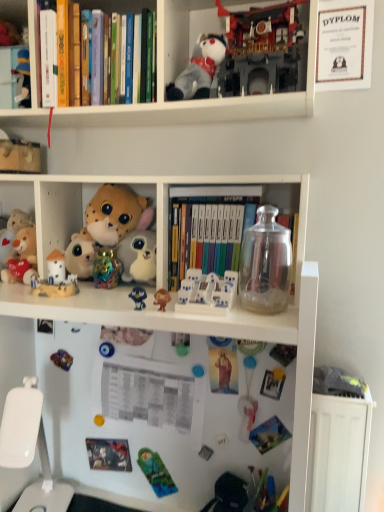
What do you see at coordinates (200, 100) in the screenshot?
I see `white matte bookshelf at upper center` at bounding box center [200, 100].

Looking at this image, what is the approximate width of white plastic toy at left, the 5th toy in the bottom-to-top sequence?

2.44 inches.

The height and width of the screenshot is (512, 384). Find the location of `green plastic toy at lower center, placed as the 1th toy when sorted from bottom to top`. green plastic toy at lower center, placed as the 1th toy when sorted from bottom to top is located at coordinates (156, 473).

In order to click on fluffy white plush at center-left, acting as the sixth toy starting from the bottom in this screenshot , I will do `click(80, 255)`.

At what (x,y) coordinates should I click in order to perform the action: click on transparent glass jar at center, arranged as the second book when viewed from the top. Please return your answer as a coordinate pair (x, y). Looking at the image, I should click on (219, 221).

Describe the element at coordinates (219, 221) in the screenshot. I see `transparent glass jar at center, the 2th book from the left` at that location.

In order to click on white matte bookshelf at upper center in this screenshot , I will do `click(200, 100)`.

Is fluffy white plush at center-left, acting as the sixth toy starting from the bottom, next to hardcover books at upper left, which ranks as the first book in left-to-right order, and touching it?

fluffy white plush at center-left, acting as the sixth toy starting from the bottom, and hardcover books at upper left, which ranks as the first book in left-to-right order, are not in contact.

Which is behind, fluffy white plush at center-left, the 5th toy in the top-to-bottom sequence, or hardcover books at upper left, which ranks as the 2th book in bottom-to-top order?

Positioned behind is fluffy white plush at center-left, the 5th toy in the top-to-bottom sequence.

Could you tell me if fluffy white plush at center-left, the 5th toy in the top-to-bottom sequence, is turned towards hardcover books at upper left, which is the 1th book in top-to-bottom order?

No, fluffy white plush at center-left, the 5th toy in the top-to-bottom sequence, is not turned towards hardcover books at upper left, which is the 1th book in top-to-bottom order.

Between fluffy white plush at center-left, the 5th toy in the top-to-bottom sequence, and hardcover books at upper left, which is the 1th book in top-to-bottom order, which one has larger width?

hardcover books at upper left, which is the 1th book in top-to-bottom order, is wider.

Considering the positions of objects hardcover books at upper left, which appears as the 2th book when viewed from the right, and blue plastic toy at center, placed as the 8th toy when sorted from top to bottom, in the image provided, who is more to the left, hardcover books at upper left, which appears as the 2th book when viewed from the right, or blue plastic toy at center, placed as the 8th toy when sorted from top to bottom,?

hardcover books at upper left, which appears as the 2th book when viewed from the right.

Does point (117, 4) appear closer or farther from the camera than point (128, 295)?

Point (117, 4) appears to be farther away from the viewer than point (128, 295).

Is hardcover books at upper left, which appears as the 2th book when viewed from the right, positioned beyond the bounds of blue plastic toy at center, placed as the 8th toy when sorted from top to bottom?

Yes, hardcover books at upper left, which appears as the 2th book when viewed from the right, is outside of blue plastic toy at center, placed as the 8th toy when sorted from top to bottom.

From a real-world perspective, who is located lower, fluffy white plush at center-left, acting as the sixth toy starting from the bottom, or white plastic toy at left, which is counted as the sixth toy, starting from the top?

In real-world perspective, white plastic toy at left, which is counted as the sixth toy, starting from the top, is lower.

Identify the location of the 4th toy behind the white plastic toy at left, the 5th toy in the bottom-to-top sequence. (80, 255).

Considering the relative sizes of fluffy white plush at center-left, the 5th toy in the top-to-bottom sequence, and white plastic toy at left, which is counted as the sixth toy, starting from the top, in the image provided, is fluffy white plush at center-left, the 5th toy in the top-to-bottom sequence, wider than white plastic toy at left, which is counted as the sixth toy, starting from the top,?

Indeed, fluffy white plush at center-left, the 5th toy in the top-to-bottom sequence, has a greater width compared to white plastic toy at left, which is counted as the sixth toy, starting from the top.

Is the surface of fluffy white plush at center-left, the 5th toy in the top-to-bottom sequence, in direct contact with white plastic toy at left, which is counted as the sixth toy, starting from the top?

fluffy white plush at center-left, the 5th toy in the top-to-bottom sequence, and white plastic toy at left, which is counted as the sixth toy, starting from the top, are not in contact.

In the scene shown: Is there a large distance between transparent glass jar at upper right and transparent glass jar at center, the 2th book from the left?

No.

Between transparent glass jar at upper right and transparent glass jar at center, which appears as the 1th book when ordered from the bottom, which one is positioned behind?

transparent glass jar at center, which appears as the 1th book when ordered from the bottom.

From the transparent glass jar at upper right, count the 1st book to the left and point to it. Please provide its 2D coordinates.

[(219, 221)]

Is transparent glass jar at center, the 2th book from the left, surrounded by white plastic swivel chair at lower left?

Actually, transparent glass jar at center, the 2th book from the left, is outside white plastic swivel chair at lower left.

Is white plastic swivel chair at lower left not close to transparent glass jar at center, which appears as the 1th book when ordered from the bottom?

No, white plastic swivel chair at lower left is not far from transparent glass jar at center, which appears as the 1th book when ordered from the bottom.

How many degrees apart are the facing directions of white plastic swivel chair at lower left and transparent glass jar at center, the 2th book from the left?

white plastic swivel chair at lower left and transparent glass jar at center, the 2th book from the left, are facing 12.7 degrees away from each other.

Consider the image. From a real-world perspective, between white plastic swivel chair at lower left and transparent glass jar at center, arranged as the second book when viewed from the top, who is vertically higher?

transparent glass jar at center, arranged as the second book when viewed from the top, from a real-world perspective.

Is blue plastic toy at center, the 3th toy positioned from the bottom, to the right of fluffy gray stuffed toy at upper center, the 9th toy from the bottom, from the viewer's perspective?

No, blue plastic toy at center, the 3th toy positioned from the bottom, is not to the right of fluffy gray stuffed toy at upper center, the 9th toy from the bottom.

Choose the correct answer: Is blue plastic toy at center, placed as the 8th toy when sorted from top to bottom, inside fluffy gray stuffed toy at upper center, marked as the 2th toy in a top-to-bottom arrangement, or outside it?

blue plastic toy at center, placed as the 8th toy when sorted from top to bottom, lies outside fluffy gray stuffed toy at upper center, marked as the 2th toy in a top-to-bottom arrangement.

Is point (145, 304) positioned behind point (183, 99)?

No, (145, 304) is closer to viewer.

Between blue plastic toy at center, the 3th toy positioned from the bottom, and fluffy gray stuffed toy at upper center, marked as the 2th toy in a top-to-bottom arrangement, which one has larger size?

fluffy gray stuffed toy at upper center, marked as the 2th toy in a top-to-bottom arrangement.

Looking at this image, is white plush cat at upper center, arranged as the 10th toy when ordered from the bottom, facing towards fluffy white plush at center-left, the 5th toy in the top-to-bottom sequence?

No, white plush cat at upper center, arranged as the 10th toy when ordered from the bottom, is not turned towards fluffy white plush at center-left, the 5th toy in the top-to-bottom sequence.

Can you confirm if white plush cat at upper center, the 1th toy in the top-to-bottom sequence, is thinner than fluffy white plush at center-left, the 5th toy in the top-to-bottom sequence?

No.

Does point (252, 15) come in front of point (76, 241)?

That is True.

How many degrees apart are the facing directions of white plush cat at upper center, arranged as the 10th toy when ordered from the bottom, and fluffy white plush at center-left, the 5th toy in the top-to-bottom sequence?

1.27 degrees.

From the hardcover books at upper left, which ranks as the first book in left-to-right order, count the 2nd toy to the left and point to it. Please provide its 2D coordinates.

[(80, 255)]

At what (x,y) coordinates should I click in order to perform the action: click on toy that is the 3rd one when counting forward from the hardcover books at upper left, which ranks as the first book in left-to-right order. Please return your answer as a coordinate pair (x, y). This screenshot has width=384, height=512. Looking at the image, I should click on tap(138, 297).

Based on their spatial positions, is fluffy gray stuffed toy at upper center, the 9th toy from the bottom, or white plush cat at upper center, the 1th toy in the top-to-bottom sequence, closer to white matte bookshelf at upper center?

white plush cat at upper center, the 1th toy in the top-to-bottom sequence, is positioned closer to the anchor white matte bookshelf at upper center.

Which object lies further to the anchor point fluffy white plush at center-left, acting as the sixth toy starting from the bottom, transparent glass jar at center, which appears as the 1th book when ordered from the bottom, or hardcover books at upper left, which ranks as the first book in left-to-right order?

hardcover books at upper left, which ranks as the first book in left-to-right order, is further to fluffy white plush at center-left, acting as the sixth toy starting from the bottom.

Considering their positions, is hardcover books at upper left, which appears as the 2th book when viewed from the right, positioned closer to white plush cat at upper center, arranged as the 10th toy when ordered from the bottom, than brown matte monkey at center, which ranks as the second toy in bottom-to-top order?

hardcover books at upper left, which appears as the 2th book when viewed from the right.

Based on their spatial positions, is fluffy white plush at center-left, acting as the sixth toy starting from the bottom, or brown matte monkey at center, which is the ninth toy from top to bottom, further from white plastic cabinet at upper left?

brown matte monkey at center, which is the ninth toy from top to bottom, is positioned further to the anchor white plastic cabinet at upper left.

Which object lies nearer to the anchor point hardcover books at upper left, which ranks as the first book in left-to-right order, white plastic toy at center, which appears as the 7th toy when viewed from the top, or white plastic cabinet at upper left?

white plastic cabinet at upper left is positioned closer to the anchor hardcover books at upper left, which ranks as the first book in left-to-right order.

Considering their positions, is white plastic cabinet at upper left positioned further to transparent glass jar at upper right than white plush cat at upper center, arranged as the 10th toy when ordered from the bottom?

white plastic cabinet at upper left lies further to transparent glass jar at upper right than the other object.

Looking at the image, which one is located closer to brown matte monkey at center, which is the ninth toy from top to bottom, wooden block at left, the eighth toy positioned from the bottom, or white plastic swivel chair at lower left?

white plastic swivel chair at lower left is closer to brown matte monkey at center, which is the ninth toy from top to bottom.

Looking at the image, which one is located closer to fluffy white plush at center-left, the 5th toy in the top-to-bottom sequence, transparent glass jar at center, which appears as the 1th book when ordered from the bottom, or white plastic toy at center, which is the fourth toy in bottom-to-top order?

The object closer to fluffy white plush at center-left, the 5th toy in the top-to-bottom sequence, is transparent glass jar at center, which appears as the 1th book when ordered from the bottom.

Where is `book that lies between fluffy gray stuffed toy at upper center, marked as the 2th toy in a top-to-bottom arrangement, and fluffy white plush at center-left, the 5th toy in the top-to-bottom sequence, from top to bottom`? The image size is (384, 512). book that lies between fluffy gray stuffed toy at upper center, marked as the 2th toy in a top-to-bottom arrangement, and fluffy white plush at center-left, the 5th toy in the top-to-bottom sequence, from top to bottom is located at coordinates (219, 221).

The height and width of the screenshot is (512, 384). Find the location of `bookcase between wooden block at left, positioned as the third toy in top-to-bottom order, and white plastic toy at center, which is the fourth toy in bottom-to-top order, in the horizontal direction`. bookcase between wooden block at left, positioned as the third toy in top-to-bottom order, and white plastic toy at center, which is the fourth toy in bottom-to-top order, in the horizontal direction is located at coordinates (200, 100).

This screenshot has width=384, height=512. Identify the location of bottle that lies between white matte bookshelf at upper center and blue plastic toy at center, the 3th toy positioned from the bottom, from top to bottom. (265, 264).

Image resolution: width=384 pixels, height=512 pixels. Find the location of `cabinet between wooden block at left, positioned as the third toy in top-to-bottom order, and transparent glass jar at center, placed as the first book when sorted from right to left, in the horizontal direction`. cabinet between wooden block at left, positioned as the third toy in top-to-bottom order, and transparent glass jar at center, placed as the first book when sorted from right to left, in the horizontal direction is located at coordinates (14, 13).